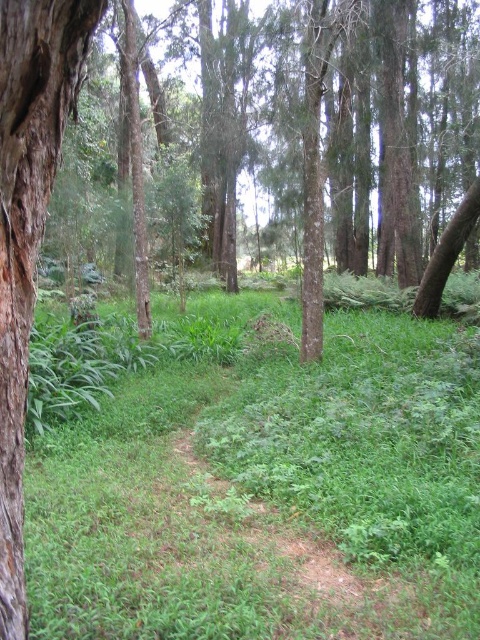
You are a hiker who wants to take a photo of the brown rough bark tree trunk at left and the green leafy grass at center. Which object should you focus on if you want the other to appear blurred in the background?

To have the brown rough bark tree trunk at left blurred in the background, focus on the green leafy grass at center since it is larger and closer to the camera. Alternatively, focusing on the brown rough bark tree trunk at left would blur the green leafy grass at center as it is farther away.

You are a hiker trying to walk along the narrow dirt path in the forest. You notice the green leafy grass at center and the brown rough bark tree trunk at left. Which one is wider in terms of their width?

The green leafy grass at center is wider than the brown rough bark tree trunk at left.